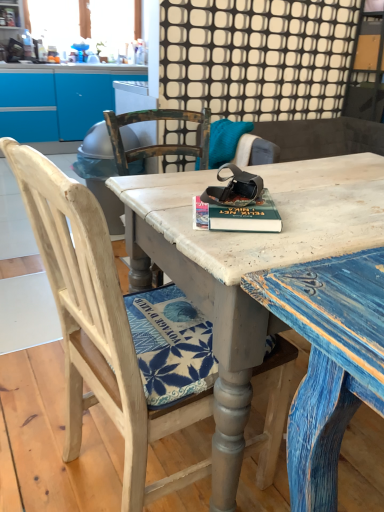
Question: Is the surface of distressed wood desk at center in direct contact with wooden chair at center?

Choices:
 (A) yes
 (B) no

Answer: (B)

Question: Is distressed wood desk at center closer to camera compared to wooden chair at center?

Choices:
 (A) yes
 (B) no

Answer: (B)

Question: From the image's perspective, does distressed wood desk at center appear higher than wooden chair at center?

Choices:
 (A) yes
 (B) no

Answer: (A)

Question: Considering the relative sizes of distressed wood desk at center and wooden chair at center in the image provided, is distressed wood desk at center bigger than wooden chair at center?

Choices:
 (A) yes
 (B) no

Answer: (A)

Question: Can you confirm if distressed wood desk at center is thinner than wooden chair at center?

Choices:
 (A) no
 (B) yes

Answer: (A)

Question: From their relative heights in the image, would you say wooden chair at center is taller or shorter than hardcover book at center?

Choices:
 (A) tall
 (B) short

Answer: (A)

Question: Considering the relative positions of wooden chair at center and hardcover book at center in the image provided, is wooden chair at center to the left or to the right of hardcover book at center?

Choices:
 (A) right
 (B) left

Answer: (B)

Question: Relative to hardcover book at center, is wooden chair at center in front or behind?

Choices:
 (A) behind
 (B) front

Answer: (B)

Question: Does point (56, 179) appear closer or farther from the camera than point (273, 224)?

Choices:
 (A) closer
 (B) farther

Answer: (A)

Question: Looking at their shapes, would you say wooden chair at center is wider or thinner than distressed wood desk at center?

Choices:
 (A) thin
 (B) wide

Answer: (A)

Question: Is wooden chair at center bigger or smaller than distressed wood desk at center?

Choices:
 (A) small
 (B) big

Answer: (A)

Question: From a real-world perspective, is wooden chair at center positioned above or below distressed wood desk at center?

Choices:
 (A) above
 (B) below

Answer: (A)

Question: In terms of height, does wooden chair at center look taller or shorter compared to distressed wood desk at center?

Choices:
 (A) tall
 (B) short

Answer: (A)

Question: Is hardcover book at center situated inside distressed wood desk at center or outside?

Choices:
 (A) outside
 (B) inside

Answer: (B)

Question: Looking at the image, does hardcover book at center seem bigger or smaller compared to distressed wood desk at center?

Choices:
 (A) small
 (B) big

Answer: (A)